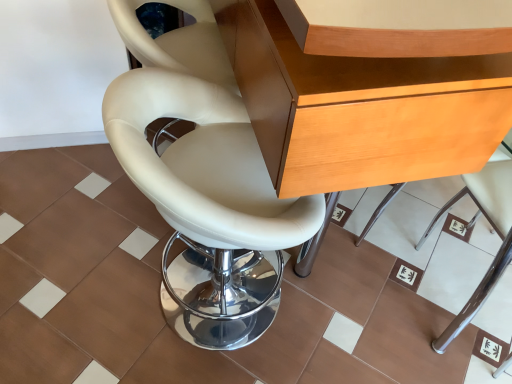
You are a GUI agent. You are given a task and a screenshot of the screen. Output one action in this format:
    pyautogui.click(x=<x>, y=<y>)
    Task: Click on the free location to the left of wooden desk at center
    
    Given the screenshot: What is the action you would take?
    pyautogui.click(x=76, y=224)